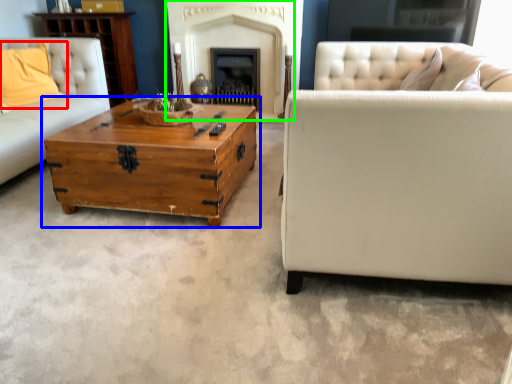
Question: Based on their relative distances, which object is farther from pillow (highlighted by a red box)? Choose from coffee table (highlighted by a blue box) and fireplace (highlighted by a green box).

Choices:
 (A) coffee table
 (B) fireplace

Answer: (B)